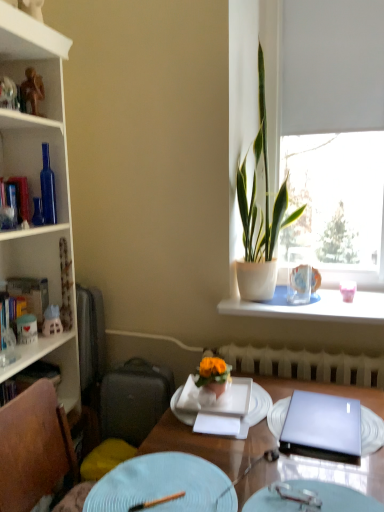
Find the location of a particular element. The image size is (384, 512). free space that is in between satin purple laptop at center and light blue textured plate at lower center, the 3th plate from the back is located at coordinates (318, 468).